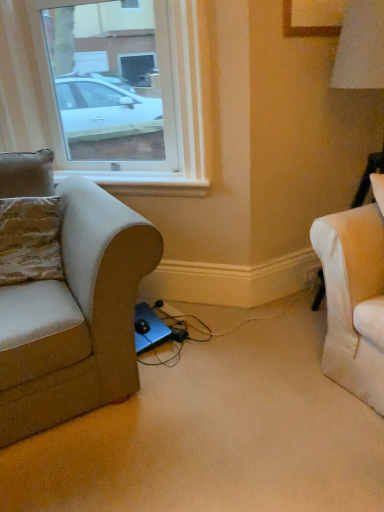
This screenshot has width=384, height=512. What are the coordinates of `white painted wood at center` in the screenshot? It's located at (143, 183).

You are a GUI agent. You are given a task and a screenshot of the screen. Output one action in this format:
    pyautogui.click(x=<x>, y=<y>)
    Task: Click on the transparent glass window at upper left
    This screenshot has height=512, width=384.
    Given the screenshot: What is the action you would take?
    pyautogui.click(x=57, y=113)

Where is `matte beige couch at left`? Image resolution: width=384 pixels, height=512 pixels. matte beige couch at left is located at coordinates (76, 317).

Describe the element at coordinates (30, 240) in the screenshot. This screenshot has height=512, width=384. I see `textured beige pillow at left` at that location.

Where is `white painted wood at center`? white painted wood at center is located at coordinates (143, 183).

Between black plastic electric outlet at lower right and matte beige couch at left, which one has larger size?

Bigger between the two is matte beige couch at left.

Which of these two, black plastic electric outlet at lower right or matte beige couch at left, is wider?

matte beige couch at left.

Is matte beige couch at left completely or partially inside black plastic electric outlet at lower right?

No, matte beige couch at left is located outside of black plastic electric outlet at lower right.

In order to click on electric outlet that appears behind the matte beige couch at left in this screenshot , I will do `click(314, 276)`.

Between matte beige couch at left and black plastic electric outlet at lower right, which one has less height?

black plastic electric outlet at lower right is shorter.

Looking at the image, does matte beige couch at left seem bigger or smaller compared to black plastic electric outlet at lower right?

Considering their sizes, matte beige couch at left takes up more space than black plastic electric outlet at lower right.

Does matte beige couch at left touch black plastic electric outlet at lower right?

They are not placed beside each other.

How distant is matte beige couch at left from black plastic electric outlet at lower right?

matte beige couch at left and black plastic electric outlet at lower right are 1.29 meters apart.

Can you tell me how much textured beige pillow at left and white painted wood at center differ in facing direction?

textured beige pillow at left and white painted wood at center are facing 29.3 degrees away from each other.

Does textured beige pillow at left touch white painted wood at center?

They are not placed beside each other.

Does textured beige pillow at left appear on the left side of white painted wood at center?

Yes.

From the image's perspective, is textured beige pillow at left located beneath white painted wood at center?

Yes, from the image's perspective, textured beige pillow at left is beneath white painted wood at center.

Considering the sizes of objects matte beige couch at left and textured beige pillow at left in the image provided, who is bigger, matte beige couch at left or textured beige pillow at left?

Bigger between the two is matte beige couch at left.

Based on the photo, relative to textured beige pillow at left, is matte beige couch at left in front or behind?

matte beige couch at left is positioned closer to the viewer than textured beige pillow at left.

Which is more to the right, matte beige couch at left or textured beige pillow at left?

matte beige couch at left.

How many degrees apart are the facing directions of matte beige couch at left and textured beige pillow at left?

The angle between the facing direction of matte beige couch at left and the facing direction of textured beige pillow at left is 17.3 degrees.

Consider the image. From the image's perspective, which one is positioned higher, blue metallic laptop at lower center or white painted wood at center?

white painted wood at center, from the image's perspective.

From a real-world perspective, is blue metallic laptop at lower center above or below white painted wood at center?

Clearly, from a real-world perspective, blue metallic laptop at lower center is below white painted wood at center.

Is blue metallic laptop at lower center turned away from white painted wood at center?

No, blue metallic laptop at lower center is not facing away from white painted wood at center.

Which of these two, blue metallic laptop at lower center or white painted wood at center, is thinner?

Thinner between the two is white painted wood at center.

Based on the photo, which of these two, blue metallic laptop at lower center or transparent glass window at upper left, is smaller?

transparent glass window at upper left is smaller.

Which object is closer to the camera, blue metallic laptop at lower center or transparent glass window at upper left?

blue metallic laptop at lower center is closer to the camera.

Is blue metallic laptop at lower center taller or shorter than transparent glass window at upper left?

blue metallic laptop at lower center is shorter than transparent glass window at upper left.

Is black plastic electric outlet at lower right a part of blue metallic laptop at lower center?

No, black plastic electric outlet at lower right is not surrounded by blue metallic laptop at lower center.

Is blue metallic laptop at lower center bigger or smaller than black plastic electric outlet at lower right?

Considering their sizes, blue metallic laptop at lower center takes up more space than black plastic electric outlet at lower right.

From a real-world perspective, is blue metallic laptop at lower center physically above black plastic electric outlet at lower right?

No, from a real-world perspective, blue metallic laptop at lower center is not over black plastic electric outlet at lower right

Consider the image. How many degrees apart are the facing directions of blue metallic laptop at lower center and black plastic electric outlet at lower right?

The angle between the facing direction of blue metallic laptop at lower center and the facing direction of black plastic electric outlet at lower right is 4.34 degrees.

You are a GUI agent. You are given a task and a screenshot of the screen. Output one action in this format:
    pyautogui.click(x=<x>, y=<y>)
    Task: Click on the studio couch above the black plastic electric outlet at lower right (from a real-world perspective)
    This screenshot has width=384, height=512.
    Given the screenshot: What is the action you would take?
    pyautogui.click(x=76, y=317)

In the image, there is a matte beige couch at left. At what (x,y) coordinates should I click in order to perform the action: click on electric outlet below it (from a real-world perspective). Please return your answer as a coordinate pair (x, y). This screenshot has width=384, height=512. Looking at the image, I should click on (314, 276).

Looking at the image, which one is located further to transparent glass window at upper left, white painted wood at center or textured beige pillow at left?

textured beige pillow at left is further to transparent glass window at upper left.

Which object lies nearer to the anchor point white painted wood at center, black plastic electric outlet at lower right or blue metallic laptop at lower center?

black plastic electric outlet at lower right.

From the image, which object appears to be farther from blue metallic laptop at lower center, textured beige pillow at left or transparent glass window at upper left?

Among the two, transparent glass window at upper left is located further to blue metallic laptop at lower center.

Considering their positions, is white painted wood at center positioned closer to transparent glass window at upper left than black plastic electric outlet at lower right?

white painted wood at center is positioned closer to the anchor transparent glass window at upper left.

Looking at the image, which one is located further to transparent glass window at upper left, textured beige pillow at left or blue metallic laptop at lower center?

blue metallic laptop at lower center lies further to transparent glass window at upper left than the other object.

From the image, which object appears to be farther from textured beige pillow at left, white painted wood at center or black plastic electric outlet at lower right?

black plastic electric outlet at lower right lies further to textured beige pillow at left than the other object.

Based on their spatial positions, is matte beige couch at left or black plastic electric outlet at lower right further from blue metallic laptop at lower center?

Based on the image, black plastic electric outlet at lower right appears to be further to blue metallic laptop at lower center.

Which object lies further to the anchor point textured beige pillow at left, black plastic electric outlet at lower right or white painted wood at center?

black plastic electric outlet at lower right is positioned further to the anchor textured beige pillow at left.

This screenshot has height=512, width=384. In order to click on window sill between transparent glass window at upper left and black plastic electric outlet at lower right from left to right in this screenshot , I will do `click(143, 183)`.

Locate an element on the screen. This screenshot has height=512, width=384. pillow that lies between transparent glass window at upper left and blue metallic laptop at lower center from top to bottom is located at coordinates (30, 240).

The width and height of the screenshot is (384, 512). What are the coordinates of `window sill between textured beige pillow at left and black plastic electric outlet at lower right in the horizontal direction` in the screenshot? It's located at (143, 183).

The height and width of the screenshot is (512, 384). What are the coordinates of `window sill between matte beige couch at left and black plastic electric outlet at lower right` in the screenshot? It's located at (143, 183).